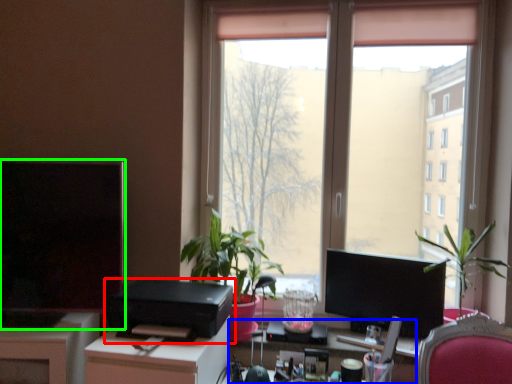
Question: Which is nearer to the printer (highlighted by a red box)? computer desk (highlighted by a blue box) or computer monitor (highlighted by a green box).

Choices:
 (A) computer desk
 (B) computer monitor

Answer: (B)